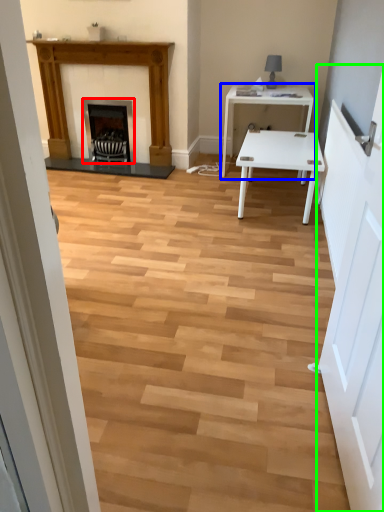
Question: Based on their relative distances, which object is nearer to fireplace (highlighted by a red box)? Choose from table (highlighted by a blue box) and door (highlighted by a green box).

Choices:
 (A) table
 (B) door

Answer: (A)